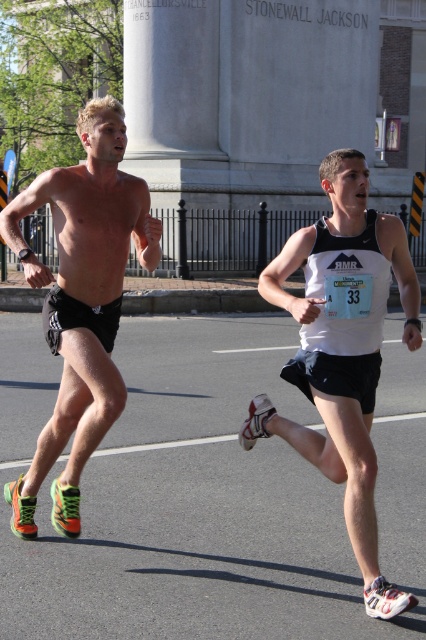
You are a photographer positioned behind the two runners. You want to take a photo that includes both the white matte tank top at center and the neon green synthetic running shoes at left in the same frame. The camera you are using has a maximum focus range of 1.1 meters. Will both objects be in focus?

The white matte tank top at center and the neon green synthetic running shoes at left are 1.08 meters apart from each other, which is within the camera maximum focus range of 1.1 meters. Therefore, both objects will be in focus.

You are a photographer at the marathon event. You need to capture a closeup shot of the white matte tank top at center and the neon green synthetic running shoes at left. Which object should you zoom in more on to ensure both are in focus?

The white matte tank top at center has a smaller size compared to neon green synthetic running shoes at left, so you should zoom in more on the neon green synthetic running shoes at left to ensure both are in focus.

In the scene shown: You are a photographer at the marathon event. You want to take a photo that clearly shows both the white matte tank top at center and the neon green synthetic running shoes at left. Based on their sizes, will the tank top appear smaller in the photo than the running shoes?

The white matte tank top at center has a lesser height compared to neon green synthetic running shoes at left, so yes, the tank top will appear smaller in the photo than the running shoes.